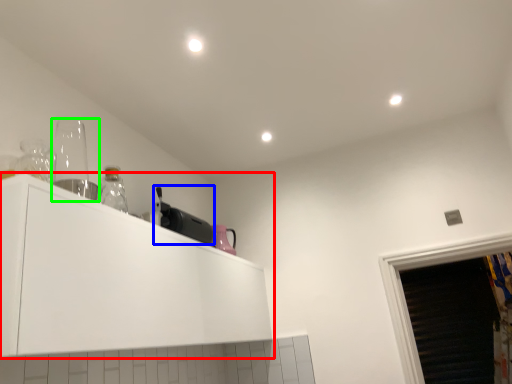
Question: Estimate the real-world distances between objects in this image. Which object is closer to cabinetry (highlighted by a red box), appliance (highlighted by a blue box) or appliance (highlighted by a green box)?

Choices:
 (A) appliance
 (B) appliance

Answer: (A)